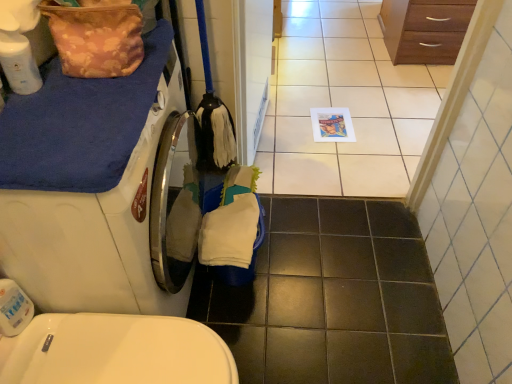
Image resolution: width=512 pixels, height=384 pixels. Find the location of `unoccupied area in front of floral fabric bag at upper left`. unoccupied area in front of floral fabric bag at upper left is located at coordinates (82, 110).